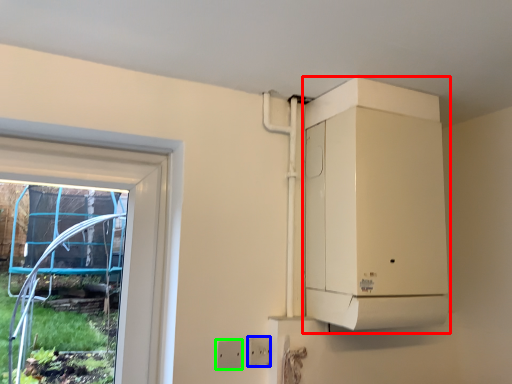
Question: Considering the real-world distances, which object is farthest from appliance (highlighted by a red box)? electric outlet (highlighted by a blue box) or electric outlet (highlighted by a green box)?

Choices:
 (A) electric outlet
 (B) electric outlet

Answer: (B)